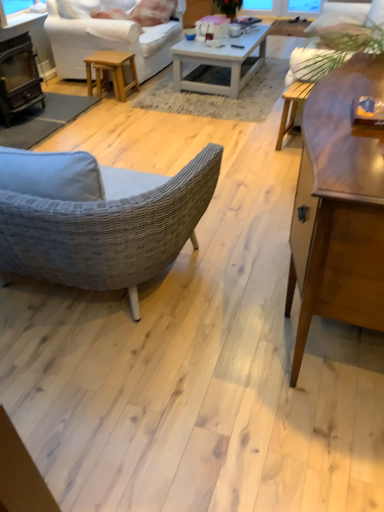
Question: Is black cast iron fireplace at left closer to camera compared to wooden coffee table at center, the first coffee table positioned from the front?

Choices:
 (A) yes
 (B) no

Answer: (B)

Question: Would you say wooden coffee table at center, which appears as the 1th coffee table when ordered from the bottom, is part of black cast iron fireplace at left's contents?

Choices:
 (A) yes
 (B) no

Answer: (B)

Question: Can you confirm if black cast iron fireplace at left is positioned to the right of wooden coffee table at center, which appears as the 2th coffee table when viewed from the back?

Choices:
 (A) no
 (B) yes

Answer: (A)

Question: Can you confirm if black cast iron fireplace at left is wider than wooden coffee table at center, the 2th coffee table in the top-to-bottom sequence?

Choices:
 (A) yes
 (B) no

Answer: (A)

Question: Does black cast iron fireplace at left have a larger size compared to wooden coffee table at center, the 2th coffee table in the top-to-bottom sequence?

Choices:
 (A) no
 (B) yes

Answer: (A)

Question: From the image's perspective, does black cast iron fireplace at left appear higher than wooden coffee table at center, which appears as the 2th coffee table when viewed from the back?

Choices:
 (A) no
 (B) yes

Answer: (B)

Question: Is white fabric couch at upper center touching white fabric studio couch at upper left?

Choices:
 (A) yes
 (B) no

Answer: (B)

Question: Could you tell me if white fabric couch at upper center is facing white fabric studio couch at upper left?

Choices:
 (A) yes
 (B) no

Answer: (A)

Question: Does white fabric couch at upper center have a greater height compared to white fabric studio couch at upper left?

Choices:
 (A) yes
 (B) no

Answer: (A)

Question: Is white fabric couch at upper center positioned far away from white fabric studio couch at upper left?

Choices:
 (A) no
 (B) yes

Answer: (B)

Question: Considering the relative positions of white fabric couch at upper center and white fabric studio couch at upper left in the image provided, is white fabric couch at upper center to the left of white fabric studio couch at upper left from the viewer's perspective?

Choices:
 (A) no
 (B) yes

Answer: (A)

Question: Is white fabric couch at upper center wider than white fabric studio couch at upper left?

Choices:
 (A) no
 (B) yes

Answer: (A)

Question: Does white cotton pillow at upper center have a larger size compared to wooden coffee table at center, which appears as the 1th coffee table when ordered from the bottom?

Choices:
 (A) no
 (B) yes

Answer: (A)